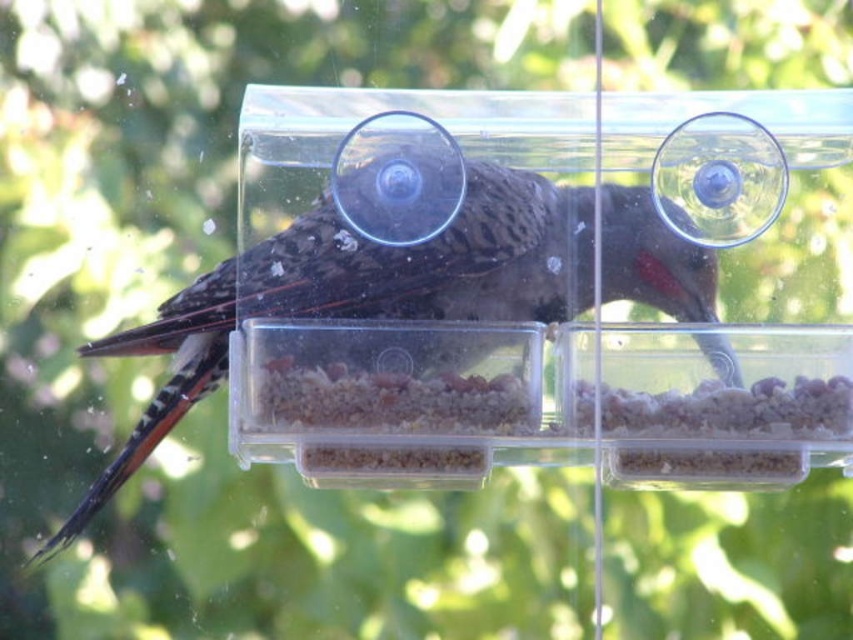
Question: Can you confirm if speckled feathered bird at center is wider than white granular food at lower right?

Choices:
 (A) no
 (B) yes

Answer: (B)

Question: Does speckled feathered bird at center appear on the left side of white granular food at lower right?

Choices:
 (A) yes
 (B) no

Answer: (A)

Question: Among these objects, which one is farthest from the camera?

Choices:
 (A) white granular food at lower right
 (B) speckled feathered bird at center

Answer: (A)

Question: Considering the real-world distances, which object is closest to the brown grainy seeds at center?

Choices:
 (A) speckled feathered bird at center
 (B) white granular food at lower right

Answer: (A)

Question: Which of the following is the closest to the observer?

Choices:
 (A) brown grainy seeds at center
 (B) speckled feathered bird at center

Answer: (B)

Question: Is brown grainy seeds at center closer to camera compared to white granular food at lower right?

Choices:
 (A) no
 (B) yes

Answer: (B)